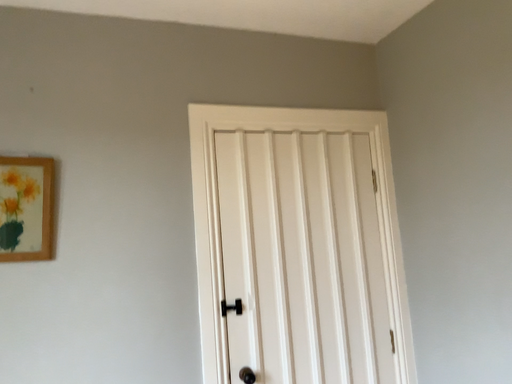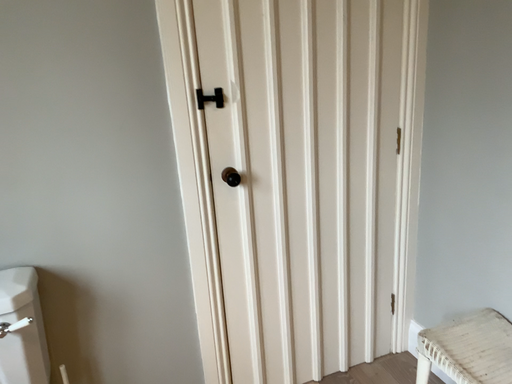
Question: How did the camera likely rotate when shooting the video?

Choices:
 (A) rotated downward
 (B) rotated upward

Answer: (A)